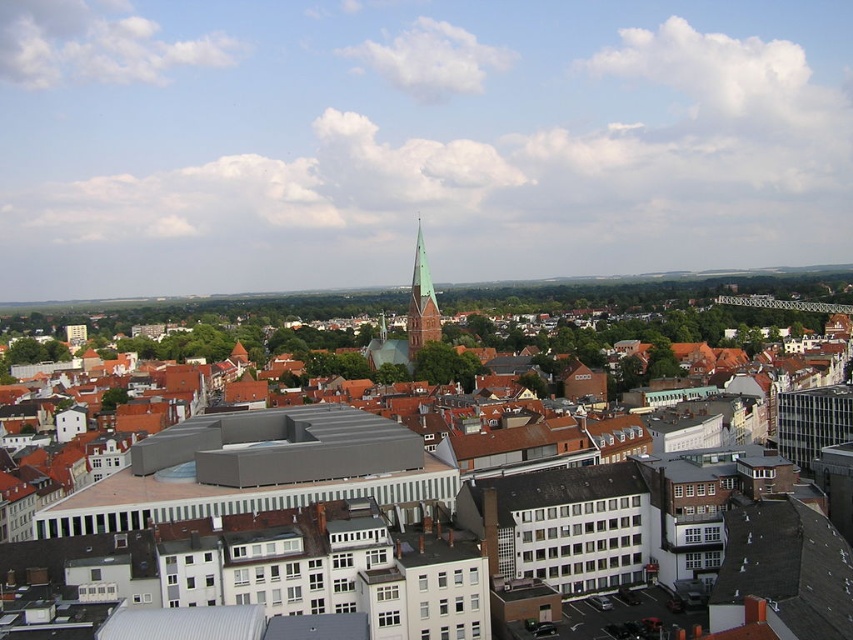
Question: Considering the relative positions of white matte building at center and green glazed brick tower at center in the image provided, where is white matte building at center located with respect to green glazed brick tower at center?

Choices:
 (A) above
 (B) below

Answer: (B)

Question: Can you confirm if white matte building at center is smaller than green glazed brick tower at center?

Choices:
 (A) yes
 (B) no

Answer: (B)

Question: Which point is closer to the camera?

Choices:
 (A) (430, 326)
 (B) (537, 516)

Answer: (B)

Question: Which object is closer to the camera taking this photo?

Choices:
 (A) green glazed brick tower at center
 (B) white matte building at center

Answer: (B)

Question: Does white matte building at center have a lesser width compared to green glazed brick tower at center?

Choices:
 (A) yes
 (B) no

Answer: (B)

Question: Which object is closer to the camera taking this photo?

Choices:
 (A) white matte building at center
 (B) green glazed brick tower at center

Answer: (A)